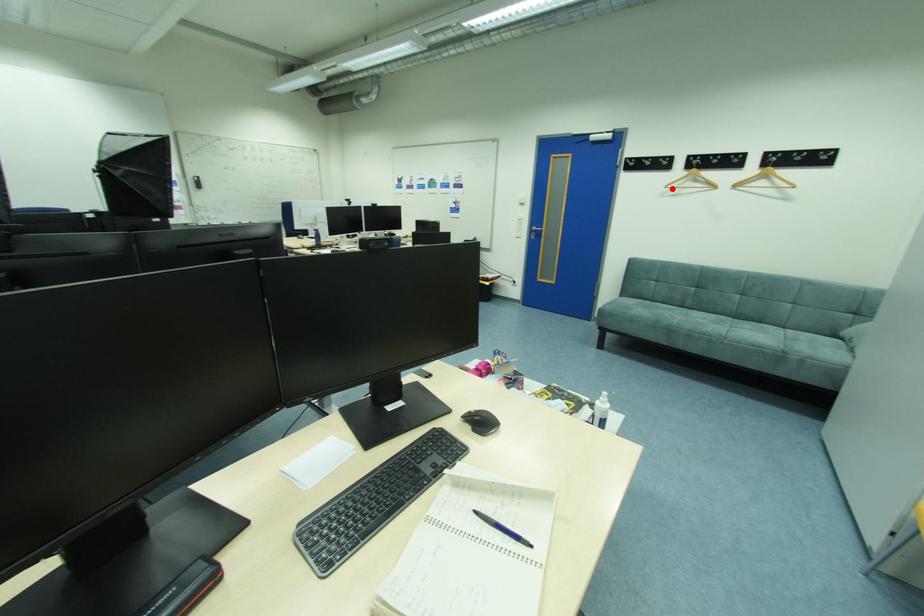
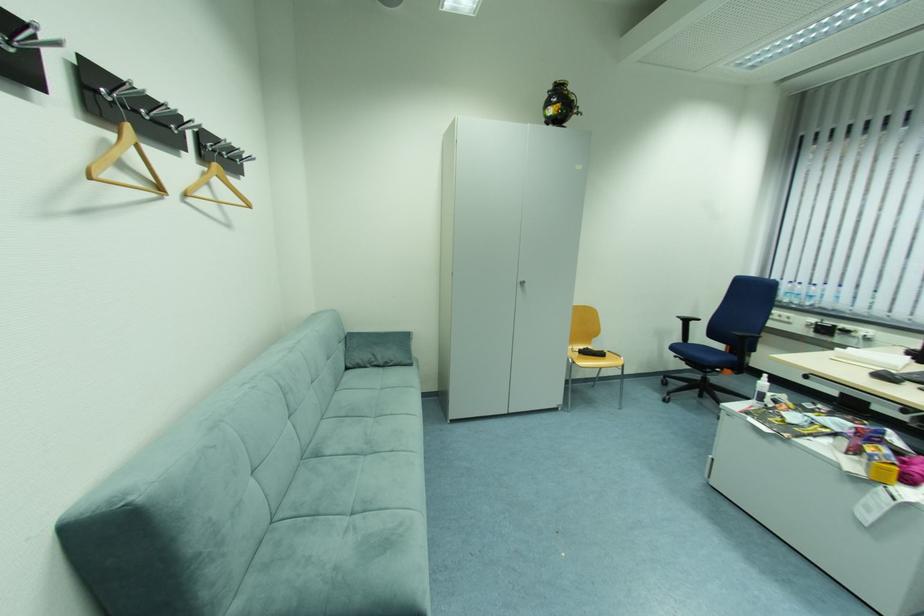
The point at the highlighted location is marked in the first image. Where is the corresponding point in the second image?

(96, 180)